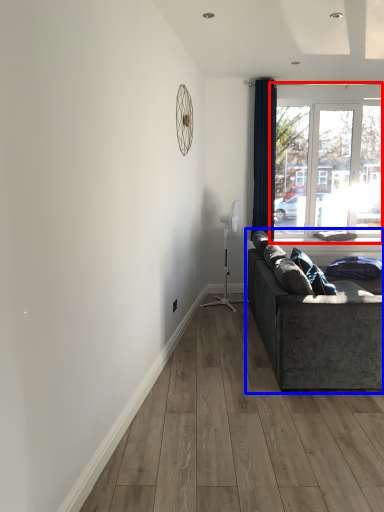
Question: Which of the following is the farthest to the observer, window (highlighted by a red box) or studio couch (highlighted by a blue box)?

Choices:
 (A) window
 (B) studio couch

Answer: (A)